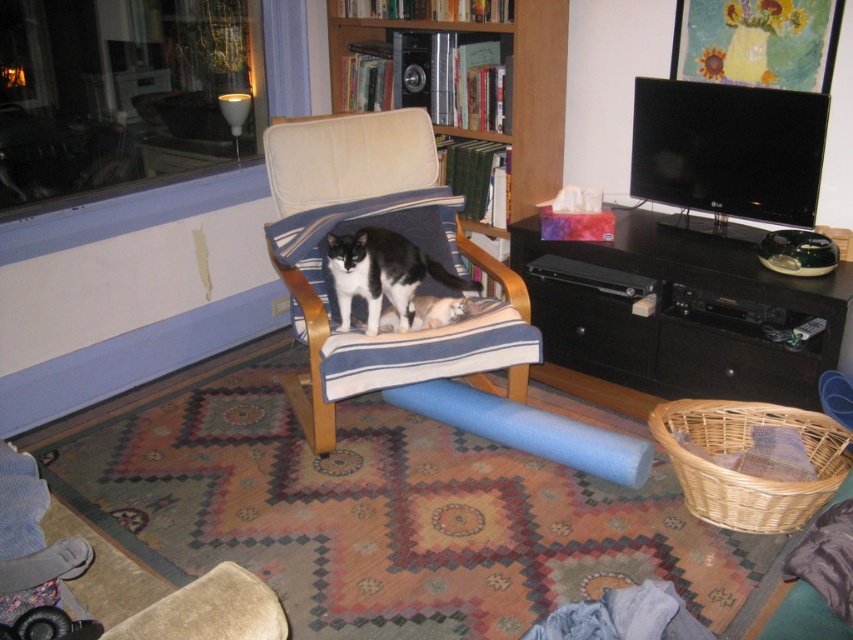
You are standing in the living room and want to move from the wooden bookshelf at upper center to the black wood entertainment center at right. Which direction should you move to reach it?

You should move to the right to reach the black wood entertainment center at right from the wooden bookshelf at upper center because it is located to the right of the bookshelf.

You are a visitor entering the living room and want to sit down. You see the black wood entertainment center at right and the soft beige fabric rocking chair at center. Which object is closer to you so you can reach it first?

The black wood entertainment center at right is closer to the viewer than the soft beige fabric rocking chair at center, so you can reach it first.

From the picture: You are standing at the center of the room and want to move towards the black wood entertainment center at right. Which direction should you move in to reach it?

Since the black wood entertainment center at right is located at point (682, 316), you should move towards the right side of the room to reach it.